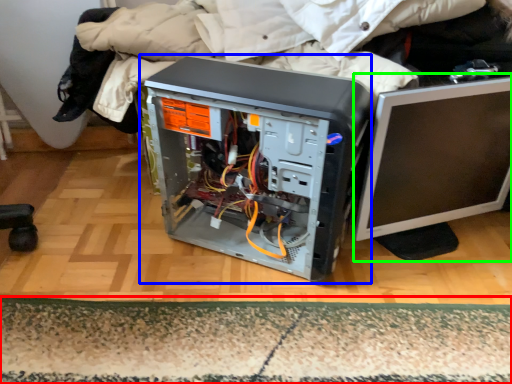
Question: Based on their relative distances, which object is nearer to mat (highlighted by a red box)? Choose from computer tower (highlighted by a blue box) and computer monitor (highlighted by a green box).

Choices:
 (A) computer tower
 (B) computer monitor

Answer: (A)